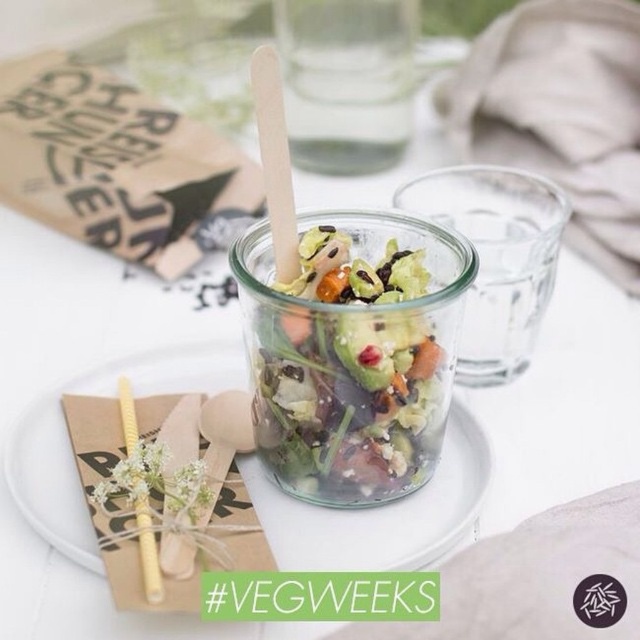
Question: Where is clear glass plate at center located in relation to clear glass jar at center in the image?

Choices:
 (A) below
 (B) above

Answer: (A)

Question: Does clear glass plate at center have a greater width compared to clear glass jar at center?

Choices:
 (A) yes
 (B) no

Answer: (A)

Question: Which point is farther to the camera?

Choices:
 (A) clear glass plate at center
 (B) clear glass jar at center

Answer: (B)

Question: Which point appears farthest from the camera in this image?

Choices:
 (A) (454, 220)
 (B) (273, 518)

Answer: (A)

Question: Can you confirm if clear glass plate at center is positioned to the left of clear glass jar at center?

Choices:
 (A) no
 (B) yes

Answer: (B)